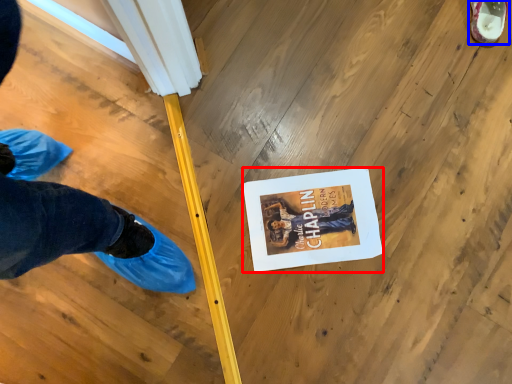
Question: Among these objects, which one is farthest to the camera, magazine (highlighted by a red box) or footwear (highlighted by a blue box)?

Choices:
 (A) magazine
 (B) footwear

Answer: (B)